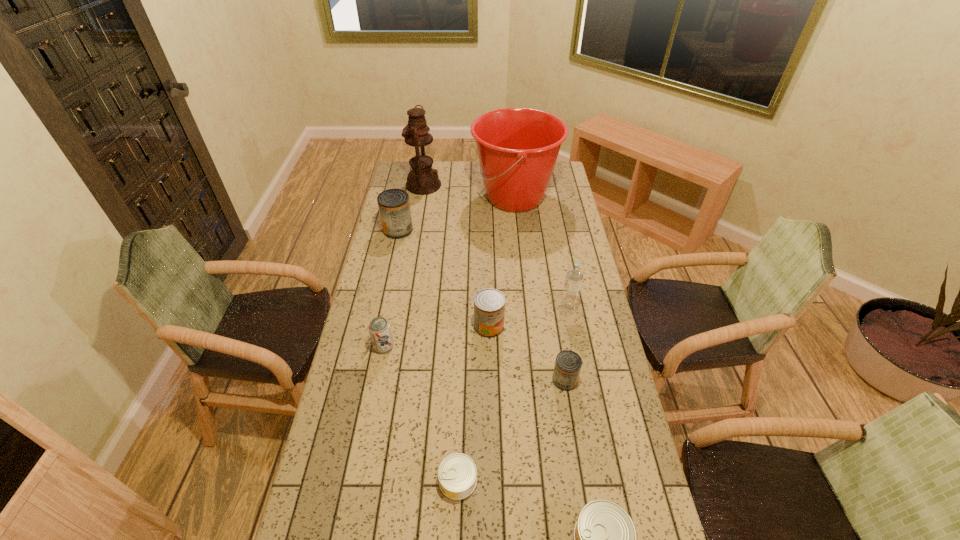
I want to click on oil lamp, so click(422, 180).

You are a GUI agent. You are given a task and a screenshot of the screen. Output one action in this format:
    pyautogui.click(x=<x>, y=<y>)
    Task: Click on the red bucket
    The width and height of the screenshot is (960, 540).
    Given the screenshot: What is the action you would take?
    pyautogui.click(x=517, y=148)

This screenshot has height=540, width=960. What are the coordinates of `the third tallest object` in the screenshot? It's located at (574, 275).

Locate an element on the screen. This screenshot has width=960, height=540. the leftmost red can is located at coordinates (394, 207).

Find the location of a particular element. The width and height of the screenshot is (960, 540). the biggest red can is located at coordinates (394, 207).

Where is `the second red can from right to left`? The image size is (960, 540). the second red can from right to left is located at coordinates (489, 304).

At what (x,y) coordinates should I click in order to perform the action: click on the fourth shortest can. Please return your answer as a coordinate pair (x, y). The height and width of the screenshot is (540, 960). Looking at the image, I should click on (489, 304).

The image size is (960, 540). What are the coordinates of `the fourth nearest object` in the screenshot? It's located at (379, 328).

The image size is (960, 540). I want to click on the third shortest can, so 568,364.

The width and height of the screenshot is (960, 540). Find the location of `the seventh farthest object`. the seventh farthest object is located at coordinates (568, 364).